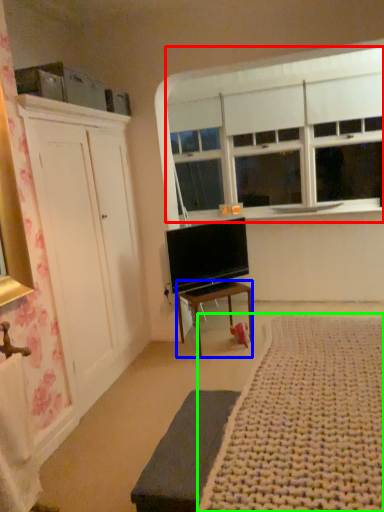
Question: Estimate the real-world distances between objects in this image. Which object is farther from window (highlighted by a red box), desk (highlighted by a blue box) or plain (highlighted by a green box)?

Choices:
 (A) desk
 (B) plain

Answer: (B)